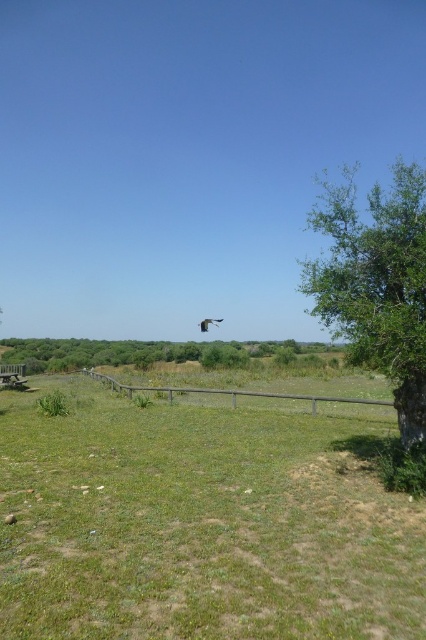
Question: Does green leafy tree at right lie behind wooden fence at center?

Choices:
 (A) no
 (B) yes

Answer: (A)

Question: Which point appears closest to the camera in this image?

Choices:
 (A) (155, 390)
 (B) (74, 362)

Answer: (A)

Question: Does green grass at lower left appear under green leafy tree at center?

Choices:
 (A) no
 (B) yes

Answer: (A)

Question: Is green grass at lower left smaller than wooden fence at center?

Choices:
 (A) yes
 (B) no

Answer: (A)

Question: Which of the following is the closest to the observer?

Choices:
 (A) green grass at lower left
 (B) wooden fence at center
 (C) green leafy tree at center

Answer: (A)

Question: Which object appears closest to the camera in this image?

Choices:
 (A) green leafy tree at right
 (B) green grass at lower left
 (C) green leafy tree at center
 (D) wooden fence at center

Answer: (B)